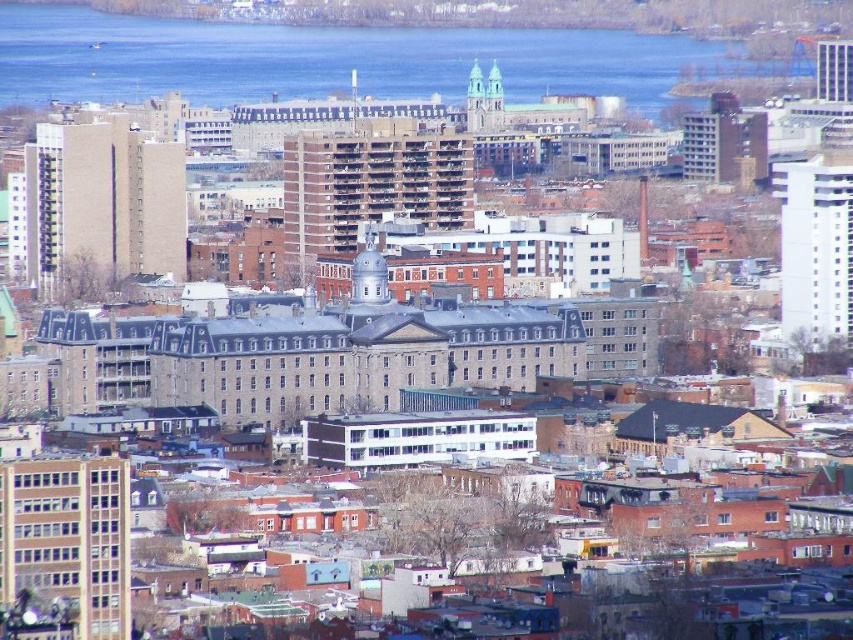
Question: Observing the image, what is the correct spatial positioning of brick textured building at center in reference to metallic glass skyscraper at upper right?

Choices:
 (A) below
 (B) above

Answer: (A)

Question: Which object is closer to the camera taking this photo?

Choices:
 (A) white smooth building at right
 (B) blue water at upper center

Answer: (B)

Question: Can you confirm if metallic glass skyscraper at upper right is smaller than metallic silver dome at center?

Choices:
 (A) no
 (B) yes

Answer: (A)

Question: Is blue water at upper center positioned in front of metallic glass skyscraper at upper right?

Choices:
 (A) yes
 (B) no

Answer: (A)

Question: Among these points, which one is farthest from the camera?

Choices:
 (A) (483, 131)
 (B) (837, 337)
 (C) (363, 288)
 (D) (30, 548)

Answer: (D)

Question: Which of these objects is positioned closest to the brick textured building at center?

Choices:
 (A) white smooth building at right
 (B) brick building at lower left
 (C) metallic glass skyscraper at upper right
 (D) blue water at upper center

Answer: (D)